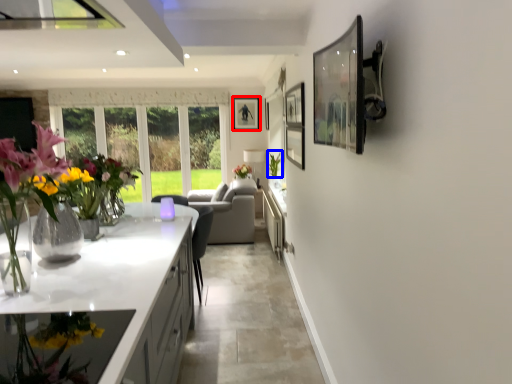
Question: Which object appears closest to the camera in this image, picture frame (highlighted by a red box) or plant (highlighted by a blue box)?

Choices:
 (A) picture frame
 (B) plant

Answer: (B)